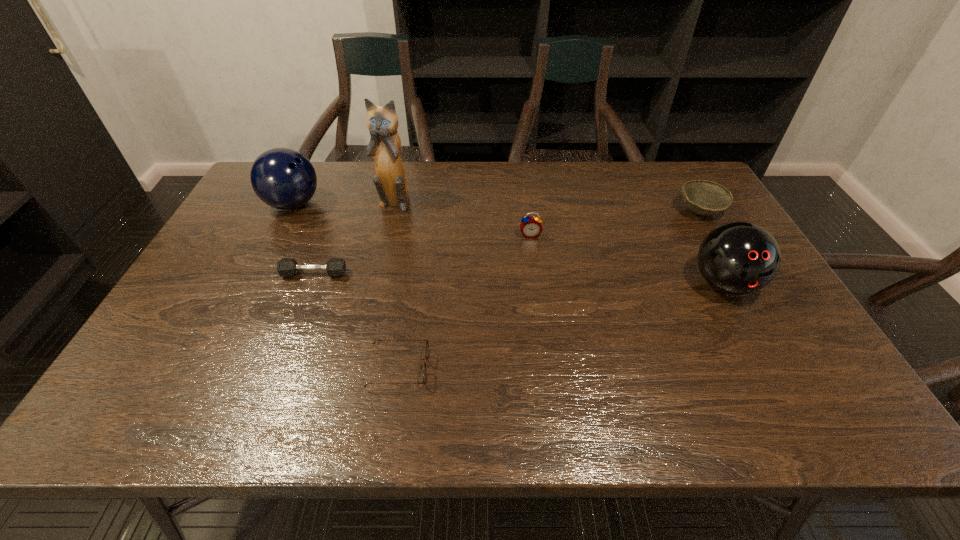
This screenshot has width=960, height=540. I want to click on object present at the left edge, so click(x=283, y=178).

Image resolution: width=960 pixels, height=540 pixels. What are the coordinates of `bowling ball that is at the right edge` in the screenshot? It's located at (738, 258).

At what (x,y) coordinates should I click in order to perform the action: click on bowl located in the right edge section of the desktop. Please return your answer as a coordinate pair (x, y). This screenshot has height=540, width=960. Looking at the image, I should click on (703, 197).

Locate an element on the screen. This screenshot has width=960, height=540. object that is at the far left corner is located at coordinates (283, 178).

Locate an element on the screen. The height and width of the screenshot is (540, 960). object positioned at the far right corner is located at coordinates (703, 197).

Where is `free location at the far edge of the desktop`? The height and width of the screenshot is (540, 960). free location at the far edge of the desktop is located at coordinates (575, 163).

This screenshot has width=960, height=540. In order to click on free spot at the left edge of the desktop in this screenshot , I will do `click(237, 246)`.

Image resolution: width=960 pixels, height=540 pixels. I want to click on vacant space at the right edge of the desktop, so click(752, 301).

The image size is (960, 540). What are the coordinates of `vacant space at the near left corner of the desktop` in the screenshot? It's located at (118, 397).

This screenshot has height=540, width=960. Identify the location of vacant space at the far right corner. [x=701, y=176].